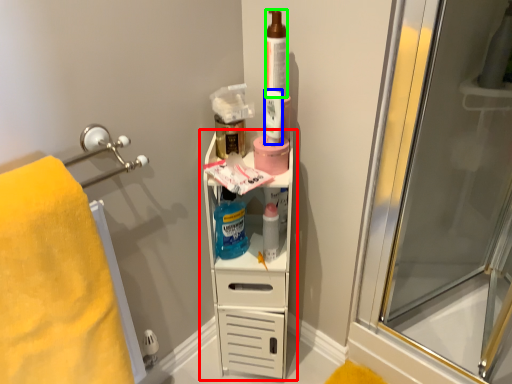
Question: Which object is positioned closest to shelf (highlighted by a red box)? Select from mouthwash (highlighted by a blue box) and toiletry (highlighted by a green box).

Choices:
 (A) mouthwash
 (B) toiletry

Answer: (A)